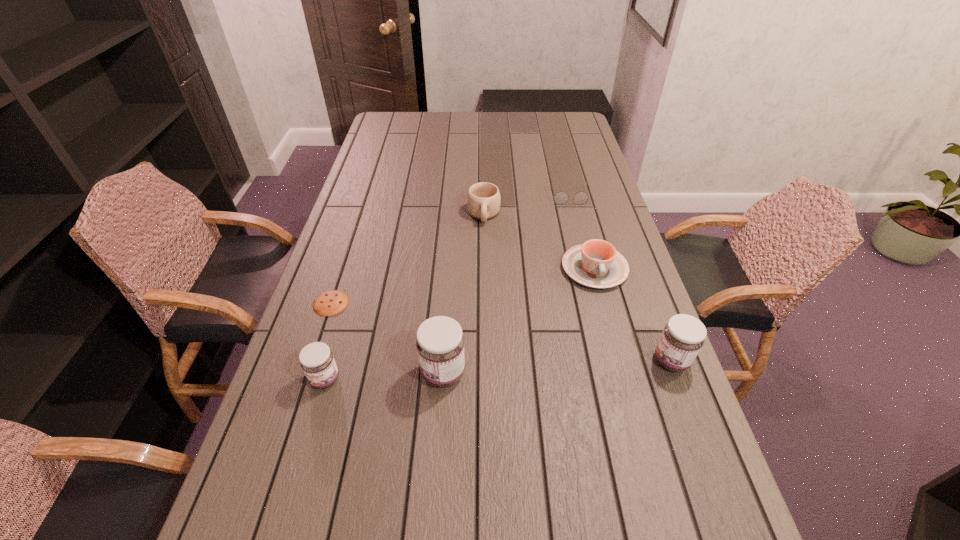
You are a GUI agent. You are given a task and a screenshot of the screen. Output one action in this format:
    pyautogui.click(x=<x>, y=<y>)
    Task: Click on the vacant area situated on the front label of the second jam from left to right
    The image size is (960, 540).
    Given the screenshot: What is the action you would take?
    [x=396, y=373]

Image resolution: width=960 pixels, height=540 pixels. Identify the location of free space located on the front label of the second jam from left to right. (357, 373).

Identify the location of vacant region located 0.170m on the front label of the second jam from left to right. The height and width of the screenshot is (540, 960). (349, 373).

The height and width of the screenshot is (540, 960). Identify the location of blank space located on the front label of the rightmost jam. (555, 360).

At what (x,y) coordinates should I click in order to perform the action: click on vacant space located on the front label of the rightmost jam. Please return your answer as a coordinate pair (x, y). The width and height of the screenshot is (960, 540). Looking at the image, I should click on pyautogui.click(x=579, y=360).

What are the coordinates of `vacant space situated 0.350m on the front label of the rightmost jam` in the screenshot? It's located at (509, 360).

Locate an element on the screen. This screenshot has width=960, height=540. free space located 0.110m on the temples of the second shortest object is located at coordinates click(575, 225).

Identify the location of vacant space located 0.180m on the right of the shortest object. The image size is (960, 540). (415, 303).

Locate an element on the screen. The width and height of the screenshot is (960, 540). free space located on the side of the mug with the handle is located at coordinates (484, 255).

Locate an element on the screen. The height and width of the screenshot is (540, 960). vacant space located on the handle side of the chinaware is located at coordinates (618, 357).